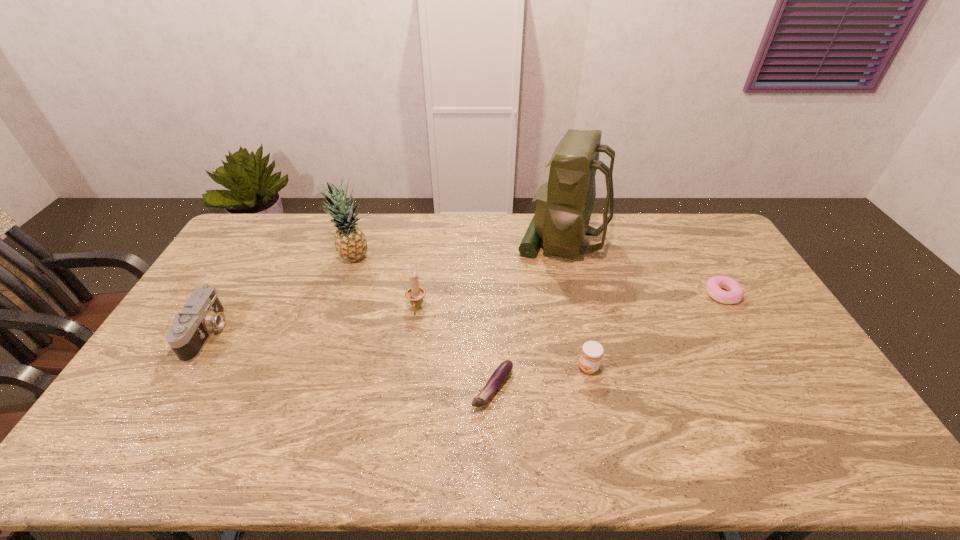
At what (x,y) coordinates should I click in order to perform the action: click on vacant region located on the back of the eggplant. Please return your answer as a coordinate pair (x, y). Looking at the image, I should click on (491, 314).

Locate an element on the screen. This screenshot has width=960, height=540. backpack that is at the far edge is located at coordinates (564, 206).

Identify the location of pineapple at the far edge. The width and height of the screenshot is (960, 540). (350, 242).

Identify the location of object present at the left edge. (203, 312).

At what (x,y) coordinates should I click in order to perform the action: click on object at the right edge. Please return your answer as a coordinate pair (x, y). The width and height of the screenshot is (960, 540). Looking at the image, I should click on (714, 284).

You are a GUI agent. You are given a task and a screenshot of the screen. Output one action in this format:
    pyautogui.click(x=<x>, y=<y>)
    Task: Click on the free space at the far edge of the desktop
    The height and width of the screenshot is (540, 960).
    Given the screenshot: What is the action you would take?
    pyautogui.click(x=502, y=231)

Find the location of a particular element. The height and width of the screenshot is (540, 960). free region at the near edge of the desktop is located at coordinates (732, 469).

The image size is (960, 540). I want to click on vacant region at the left edge of the desktop, so click(x=154, y=398).

Where is `free point at the right edge`? Image resolution: width=960 pixels, height=540 pixels. free point at the right edge is located at coordinates (758, 368).

This screenshot has width=960, height=540. What are the coordinates of `vacant area between the sixth shortest object and the pastry` in the screenshot? It's located at (538, 276).